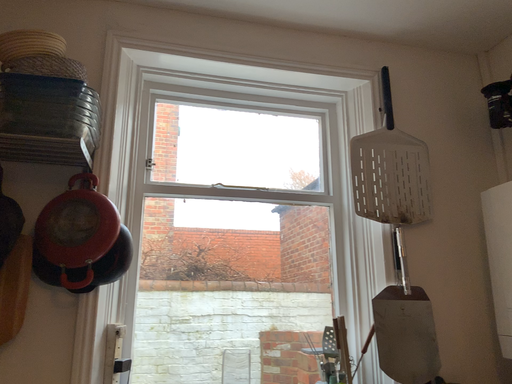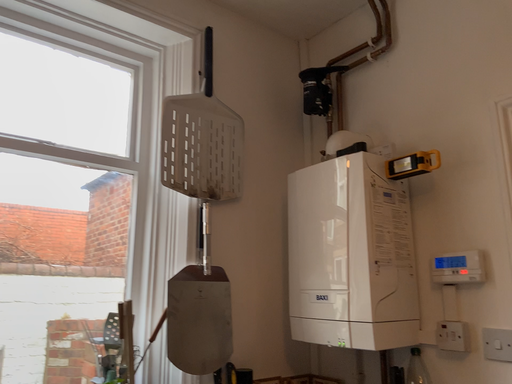
Question: How did the camera likely rotate when shooting the video?

Choices:
 (A) rotated left
 (B) rotated right

Answer: (B)